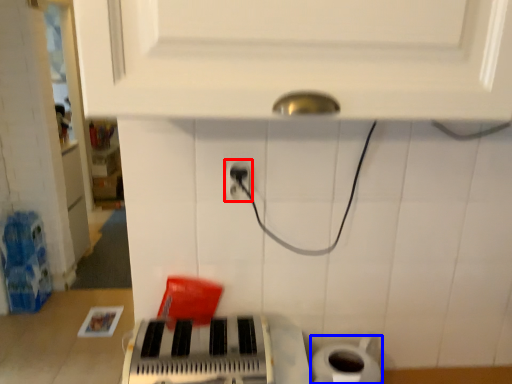
Question: Which object is further to the camera taking this photo, power plugs and sockets (highlighted by a red box) or toilet paper (highlighted by a blue box)?

Choices:
 (A) power plugs and sockets
 (B) toilet paper

Answer: (B)